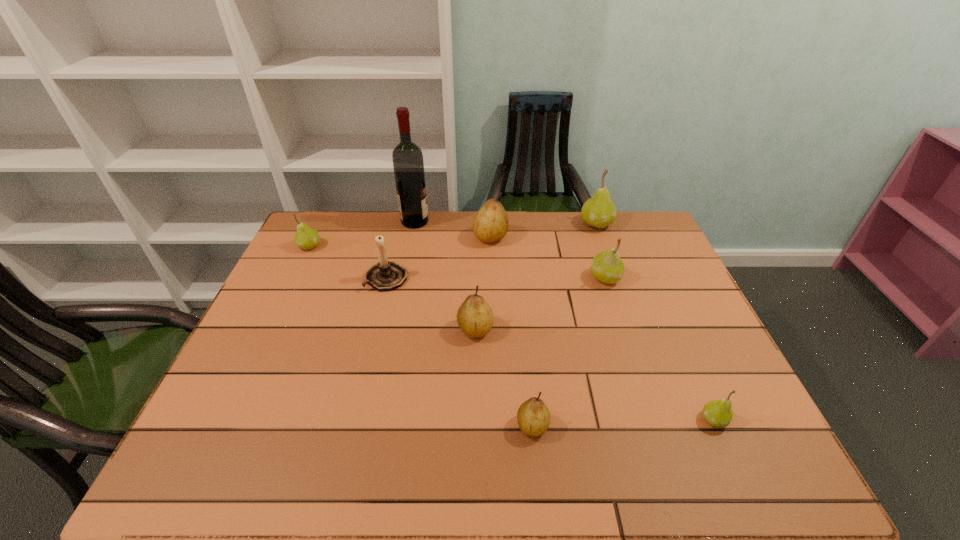
The height and width of the screenshot is (540, 960). Identify the location of free region at the near edge of the desktop. [280, 442].

In the image, there is a desktop. At what (x,y) coordinates should I click in order to perform the action: click on vacant space at the left edge. Please return your answer as a coordinate pair (x, y). Image resolution: width=960 pixels, height=540 pixels. Looking at the image, I should click on 274,334.

Where is `free space at the right edge`? free space at the right edge is located at coordinates (647, 257).

The height and width of the screenshot is (540, 960). In the image, there is a desktop. In order to click on free space at the far left corner in this screenshot , I will do `click(335, 231)`.

Image resolution: width=960 pixels, height=540 pixels. Find the location of `free space at the near left corner of the desktop`. free space at the near left corner of the desktop is located at coordinates (187, 455).

In the image, there is a desktop. In order to click on vacant area at the far right corner in this screenshot , I will do `click(616, 246)`.

Locate an element on the screen. The image size is (960, 540). vacant area between the smallest brown pear and the brown candle holder is located at coordinates (460, 352).

I want to click on unoccupied position between the rightmost green pear and the second nearest green pear, so [x=660, y=349].

Locate an element on the screen. vacant area between the rightmost pear and the candle holder is located at coordinates (550, 349).

Identify the location of free space between the tallest pear and the biggest brown pear. Image resolution: width=960 pixels, height=540 pixels. (543, 231).